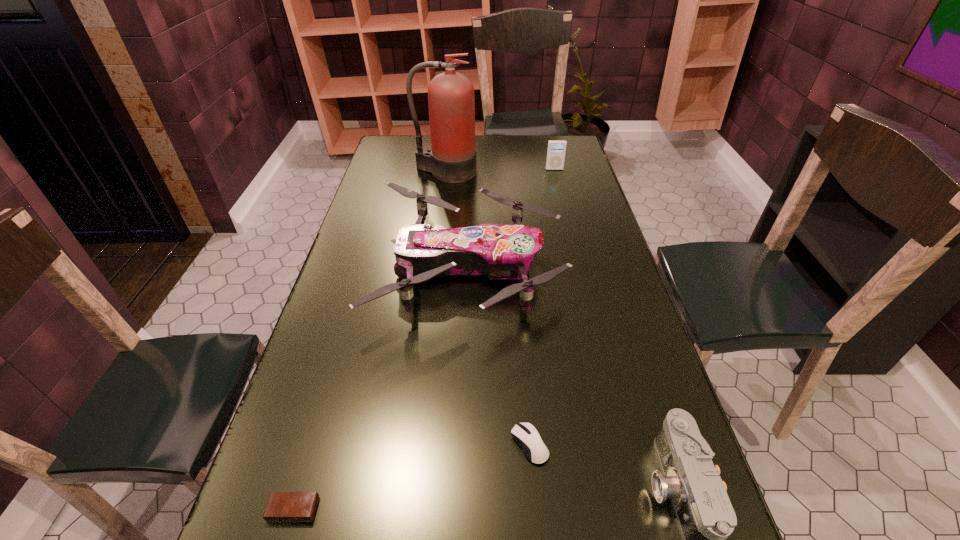
At what (x,y) coordinates should I click in order to perform the action: click on vacant area that lies between the tallest object and the fifth tallest object. Please return your answer as a coordinate pair (x, y). The height and width of the screenshot is (540, 960). Looking at the image, I should click on (488, 308).

Find the location of a particular element. The height and width of the screenshot is (540, 960). vacant space that is in between the fourth nearest object and the iPod is located at coordinates (512, 219).

This screenshot has width=960, height=540. Find the location of `vacant area that lies between the iPod and the fire extinguisher`. vacant area that lies between the iPod and the fire extinguisher is located at coordinates (499, 171).

Find the location of a particular element. This screenshot has width=960, height=540. vacant point located between the shortest object and the fourth nearest object is located at coordinates (381, 389).

You are a GUI agent. You are given a task and a screenshot of the screen. Output one action in this format:
    pyautogui.click(x=<x>, y=<y>)
    Task: Click on the unoccupied area between the alarm clock and the iPod
    Image resolution: width=960 pixels, height=540 pixels.
    Given the screenshot: What is the action you would take?
    pyautogui.click(x=424, y=339)

Identify the location of free point between the fourth nearest object and the alarm clock. (381, 389).

Where is `vacant region between the iPod and the drone`? This screenshot has width=960, height=540. vacant region between the iPod and the drone is located at coordinates (512, 219).

Locate an element on the screen. The height and width of the screenshot is (540, 960). free space between the fire extinguisher and the fifth tallest object is located at coordinates (488, 308).

Identify which object is the fourth closest to the drone. Please provide its 2D coordinates. Your answer should be formatted as a tuple, i.e. [(x, y)], where the tuple contains the x and y coordinates of a point satisfying the conditions above.

[(556, 150)]

Identify which object is the fourth closest to the fourth nearest object. Please provide its 2D coordinates. Your answer should be formatted as a tuple, i.e. [(x, y)], where the tuple contains the x and y coordinates of a point satisfying the conditions above.

[(556, 150)]